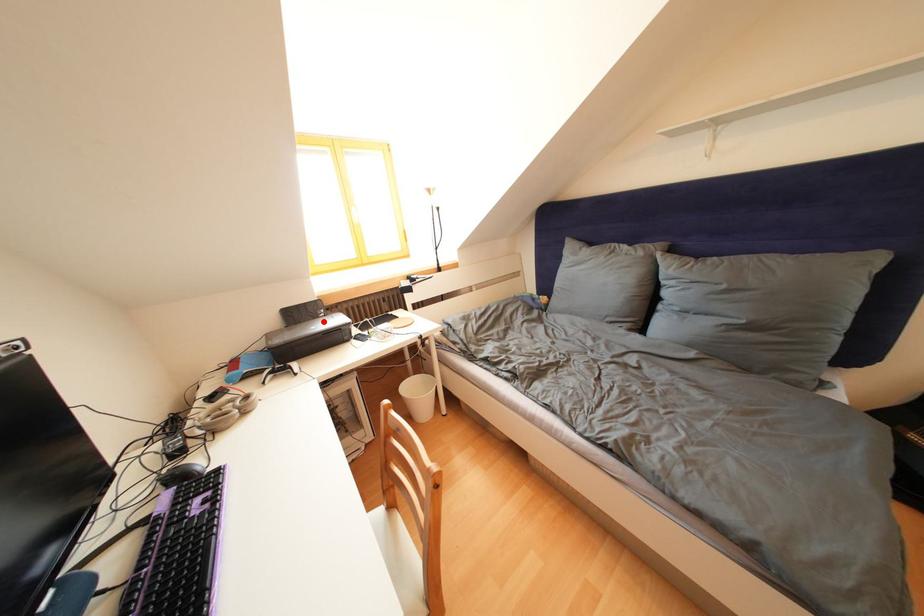
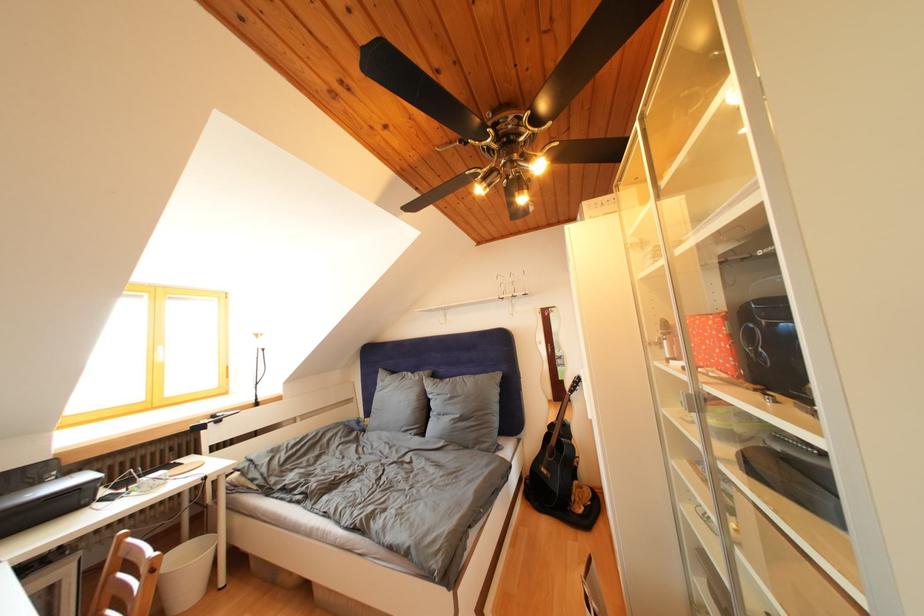
Locate, in the second image, the point that corresponds to the highlighted location in the first image.

(44, 488)